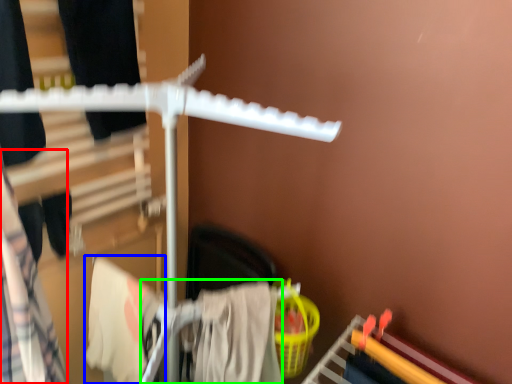
Question: Which object is positioned closest to clothing (highlighted by a red box)? Select from clothing (highlighted by a blue box) and clothing (highlighted by a green box).

Choices:
 (A) clothing
 (B) clothing

Answer: (A)